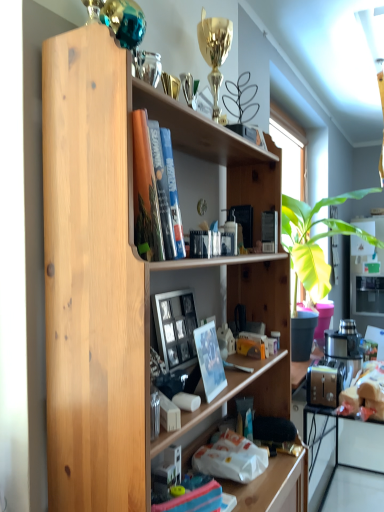
Question: In the image, is wooden picture frame at center positioned in front of or behind matte white photo frame at center?

Choices:
 (A) behind
 (B) front

Answer: (A)

Question: From the image's perspective, is wooden picture frame at center above or below matte white photo frame at center?

Choices:
 (A) below
 (B) above

Answer: (B)

Question: Which of these objects is positioned farthest from the matte white photo frame at center?

Choices:
 (A) white glossy computer at lower right
 (B) wooden picture frame at center
 (C) natural wood bookshelf at center

Answer: (A)

Question: Estimate the real-world distances between objects in this image. Which object is farther from the wooden picture frame at center?

Choices:
 (A) white glossy computer at lower right
 (B) matte white photo frame at center
 (C) natural wood bookshelf at center

Answer: (A)